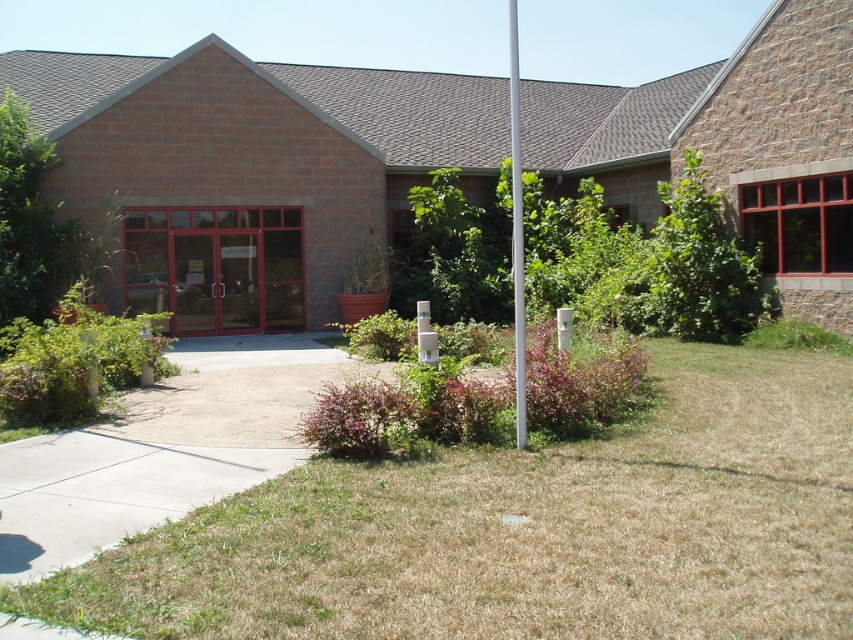
Does brown grass at lower center appear on the right side of white metallic pole at center?

Incorrect, brown grass at lower center is not on the right side of white metallic pole at center.

Who is more distant from viewer, (x=16, y=609) or (x=517, y=163)?

The point (x=517, y=163) is more distant.

The height and width of the screenshot is (640, 853). I want to click on brown grass at lower center, so click(525, 531).